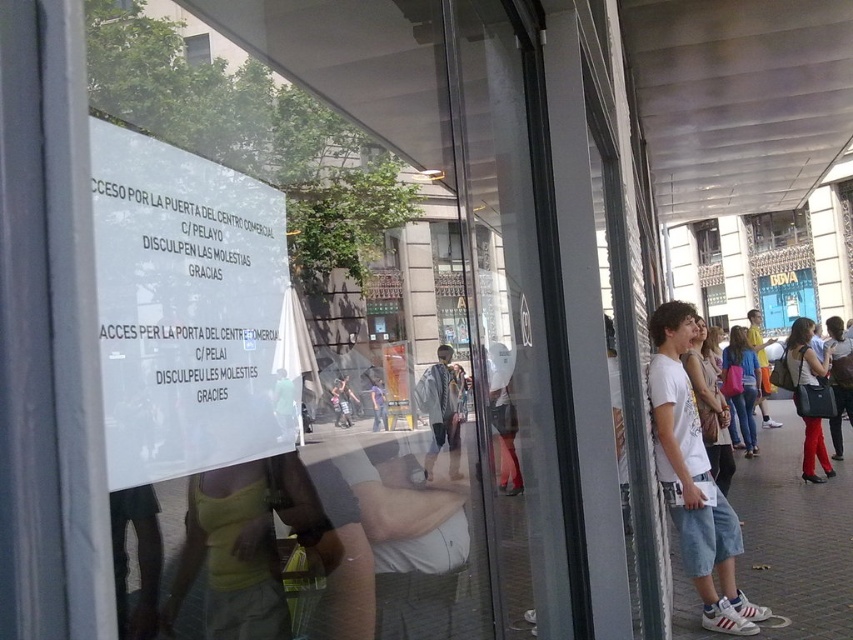
You are a delivery person trying to locate the entrance to the commercial center mentioned in the sign. You see the brown brick pavement at lower right and the white cotton shirt at right. Which object is closer to the ground?

The brown brick pavement at lower right is closer to the ground because it is not as tall as the white cotton shirt at right.